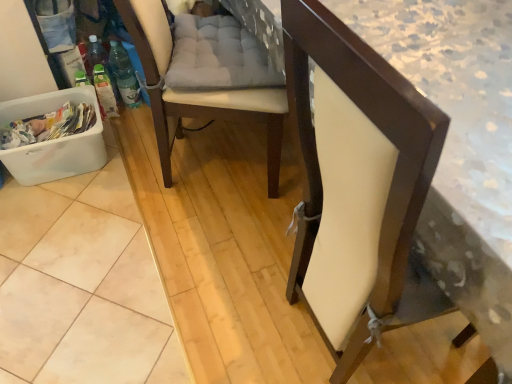
Locate an element on the screen. vacant space to the right of white plastic laundry basket at lower left is located at coordinates (146, 165).